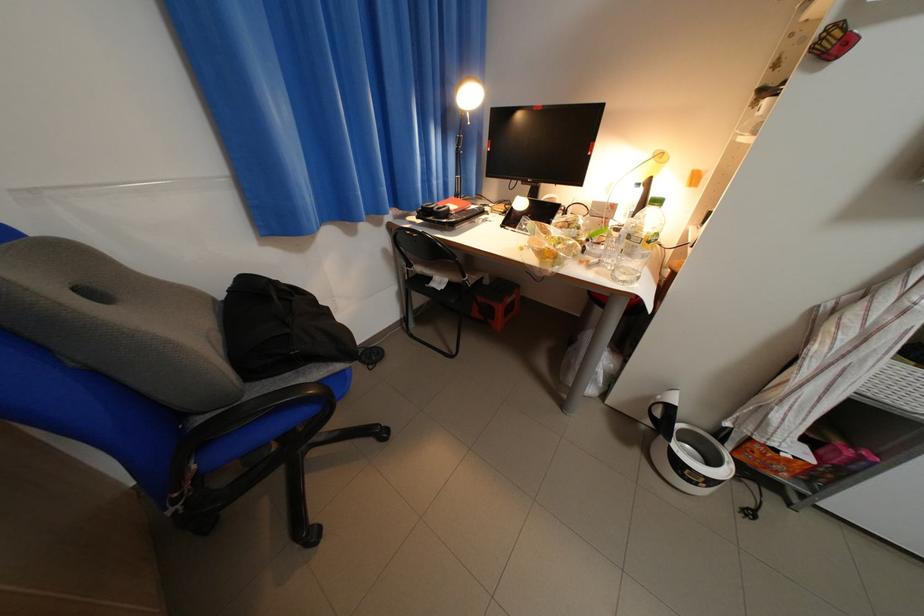
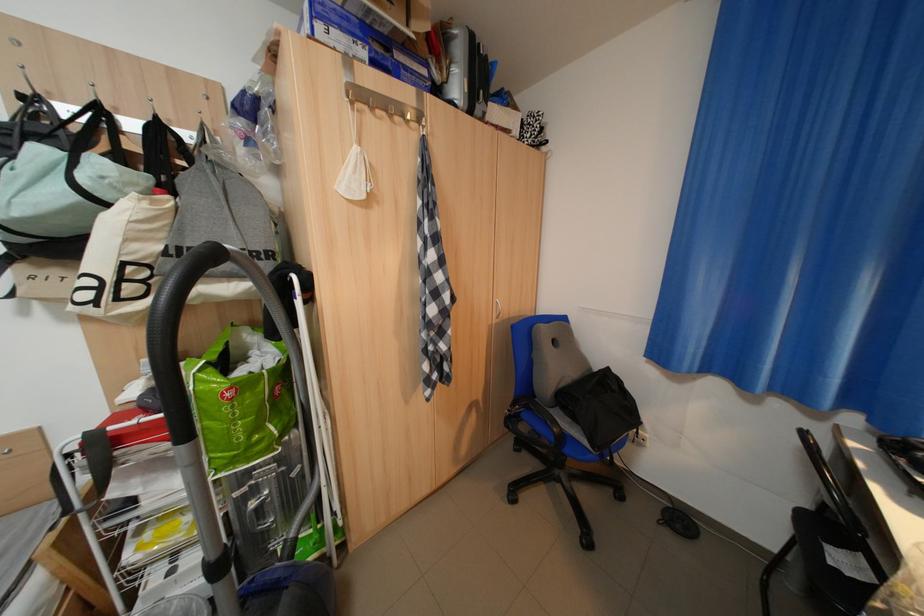
The first image is from the beginning of the video and the second image is from the end. How did the camera likely rotate when shooting the video?

The rotation direction of the camera is left-down.